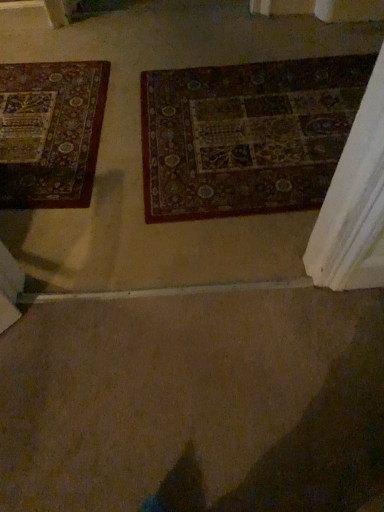
The image size is (384, 512). What are the coordinates of `blank space above dark brown woven mat at center (from a real-world perspective)` in the screenshot? It's located at (256, 122).